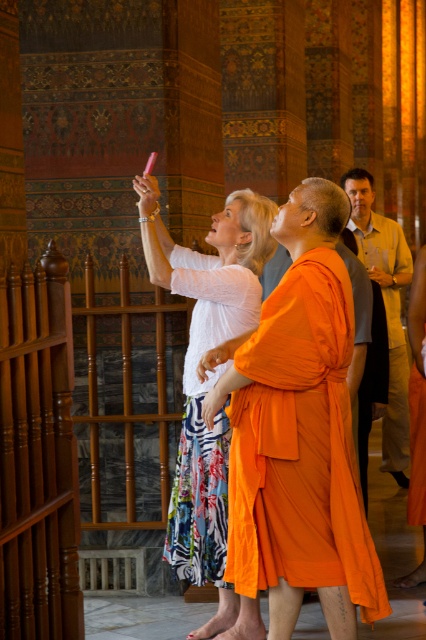
Question: Considering the relative positions of white cotton blouse at upper left and light beige shirt at right in the image provided, where is white cotton blouse at upper left located with respect to light beige shirt at right?

Choices:
 (A) below
 (B) above

Answer: (A)

Question: Can you confirm if orange silk robe at center is positioned below light beige shirt at right?

Choices:
 (A) no
 (B) yes

Answer: (B)

Question: Which point appears closest to the camera in this image?

Choices:
 (A) (192, 504)
 (B) (307, 448)
 (C) (391, 426)

Answer: (B)

Question: Among these points, which one is nearest to the camera?

Choices:
 (A) (406, 257)
 (B) (339, 406)

Answer: (B)

Question: Does orange silk robe at center have a larger size compared to white cotton blouse at upper left?

Choices:
 (A) yes
 (B) no

Answer: (B)

Question: Which point is farther to the camera?

Choices:
 (A) (385, 404)
 (B) (210, 280)

Answer: (A)